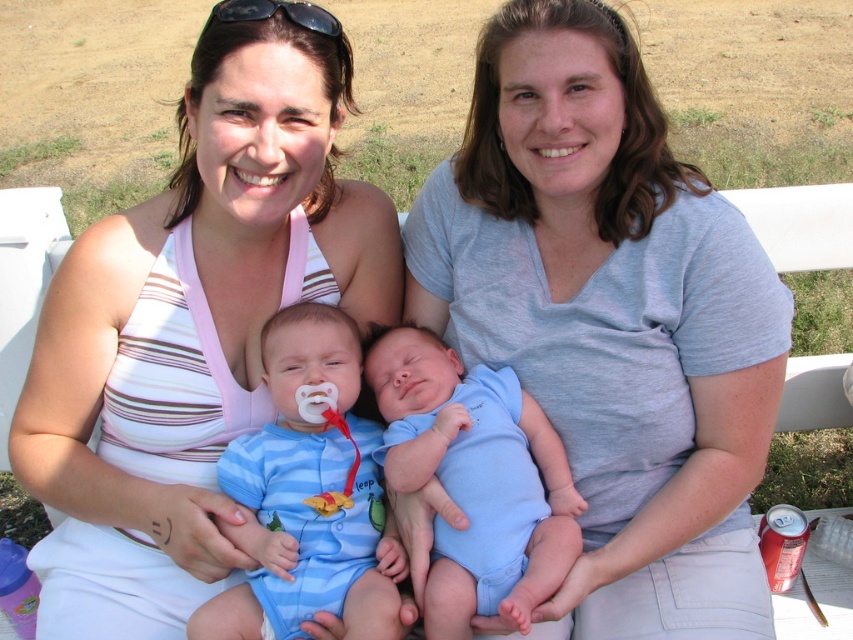
You are a photographer standing 2 meters away from the two women on the bench. You want to take a photo of the woman in the white striped tank top at center without including the other woman. Is there enough space between them to achieve this?

The two women are 1.29 meters apart. Since you are 2 meters away, you can adjust your camera angle or position to capture the woman in the white striped tank top at center while excluding the other woman, as the distance between them allows for such framing.

You are a photographer trying to capture a closeup of both the white striped tank top at center and the blue cotton onesie at center in the image. What is the minimum distance you need to adjust your camera lens to ensure both are in focus?

The white striped tank top at center and blue cotton onesie at center are 6.91 inches apart from each other. To ensure both are in focus, the camera lens should be adjusted to a focal length that can accommodate this distance, typically requiring a depth of field that covers at least 6.91 inches.

You are a photographer trying to capture a candid shot of the baby in the light blue onesie with Winnie the Pooh. You notice two points marked in the scene at coordinates point (163,528) and point (248,614). If you want to position yourself behind the baby to get a better angle, which coordinate point should you choose?

You should choose point (163,528) because it is behind point (248,614), meaning it is positioned further back relative to the baby.